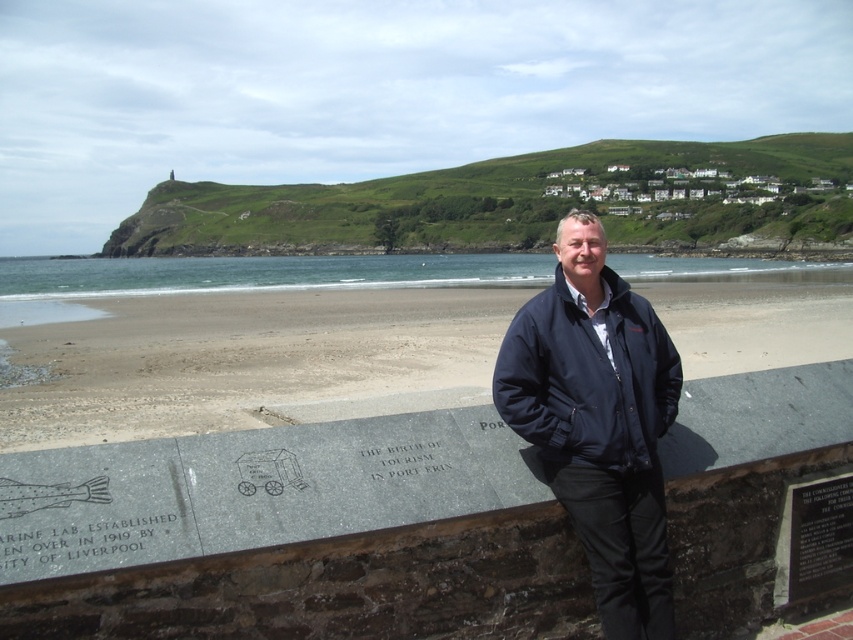
Question: Which object is closer to the camera taking this photo?

Choices:
 (A) gray stone monument at lower center
 (B) black metal plaque at lower right
 (C) black stone plaque at lower left

Answer: (C)

Question: Is smooth sand at center thinner than black metal plaque at lower right?

Choices:
 (A) no
 (B) yes

Answer: (A)

Question: Does black metal plaque at lower right appear on the left side of silver metallic plaque at center?

Choices:
 (A) no
 (B) yes

Answer: (A)

Question: Observing the image, what is the correct spatial positioning of gray stone monument at lower center in reference to smooth sand at center?

Choices:
 (A) right
 (B) left

Answer: (B)

Question: Which point is closer to the camera taking this photo?

Choices:
 (A) (263, 480)
 (B) (639, 376)
 (C) (221, 378)

Answer: (A)

Question: Among these points, which one is farthest from the camera?

Choices:
 (A) (645, 497)
 (B) (773, 522)

Answer: (B)